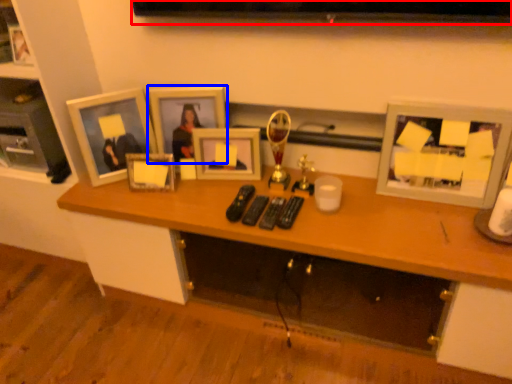
Question: Which point is closer to the camera, television (highlighted by a red box) or picture frame (highlighted by a blue box)?

Choices:
 (A) television
 (B) picture frame

Answer: (A)